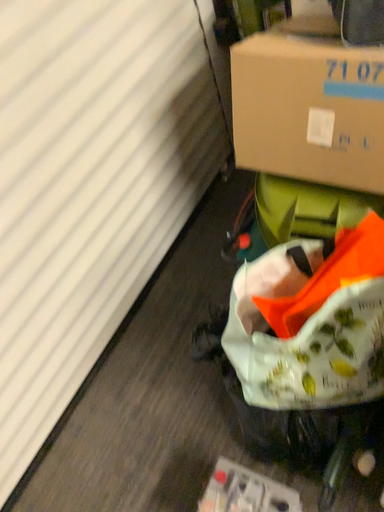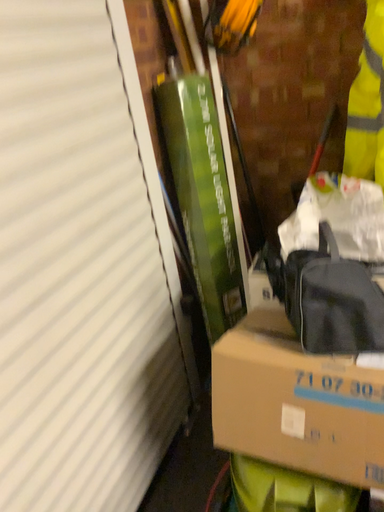
Question: How did the camera likely rotate when shooting the video?

Choices:
 (A) rotated downward
 (B) rotated upward

Answer: (B)